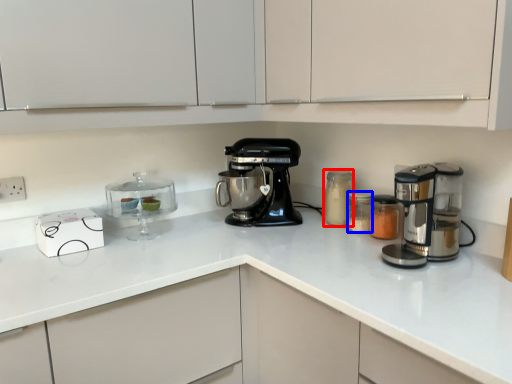
Question: Among these objects, which one is nearest to the camera, bottle (highlighted by a red box) or appliance (highlighted by a blue box)?

Choices:
 (A) bottle
 (B) appliance

Answer: (B)